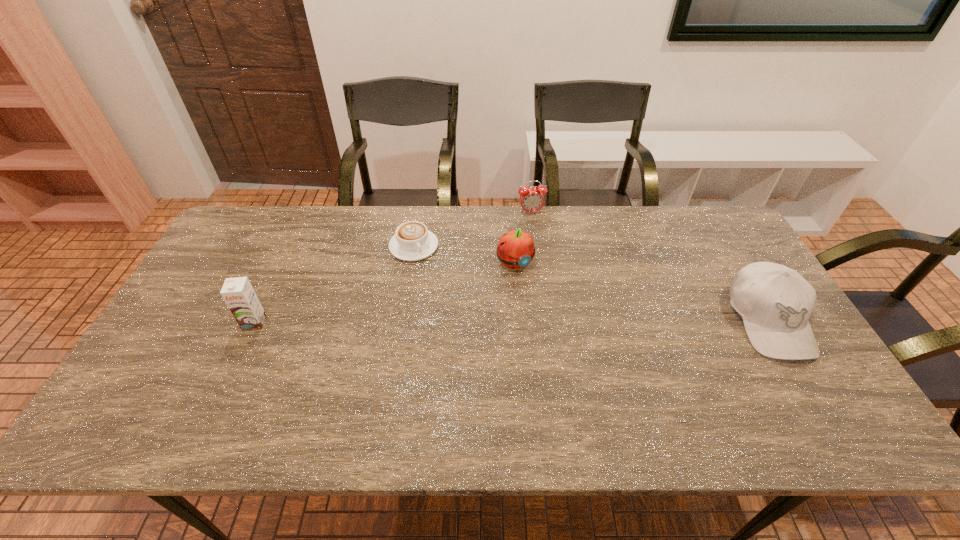
This screenshot has width=960, height=540. What are the coordinates of `free space located 0.390m on the surface of the apple` in the screenshot? It's located at (602, 376).

Identify the location of free space located 0.050m with the handle on the right side of the second object from left to right. (433, 269).

Identify the location of vacant space situated 0.190m with the handle on the right side of the second object from left to right. The image size is (960, 540). click(x=456, y=298).

Identify the location of vacant space located 0.180m with the handle on the right side of the second object from left to right. This screenshot has width=960, height=540. (454, 295).

I want to click on vacant region located on the face of the alarm clock, so click(539, 242).

This screenshot has width=960, height=540. I want to click on free space located on the face of the alarm clock, so click(x=540, y=248).

Locate an element on the screen. This screenshot has height=540, width=960. vacant space situated on the face of the alarm clock is located at coordinates (546, 272).

What are the coordinates of `apple present at the far edge` in the screenshot? It's located at (515, 250).

In order to click on cappuccino that is at the far edge in this screenshot , I will do `click(412, 241)`.

The width and height of the screenshot is (960, 540). In order to click on alarm clock that is at the far edge in this screenshot , I will do `click(531, 199)`.